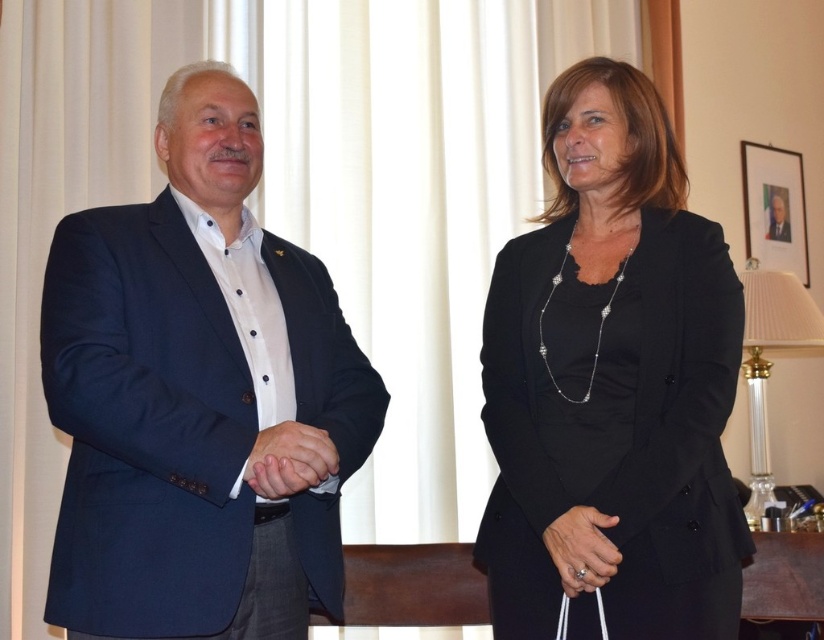
Who is positioned more to the left, matte black suit at left or matte black hand at center?

matte black suit at left

Who is positioned more to the right, matte black suit at left or matte black hand at center?

matte black hand at center

Find the location of a particular element. This screenshot has width=824, height=640. matte black suit at left is located at coordinates (195, 396).

Can you confirm if black satin blazer at center is wider than matte black hands at center?

Indeed, black satin blazer at center has a greater width compared to matte black hands at center.

Locate an element on the screen. This screenshot has height=640, width=824. black satin blazer at center is located at coordinates (612, 376).

The width and height of the screenshot is (824, 640). In order to click on black satin blazer at center in this screenshot , I will do `click(612, 376)`.

Does matte black hands at center come behind matte black hand at center?

No, it is in front of matte black hand at center.

This screenshot has width=824, height=640. What do you see at coordinates (289, 460) in the screenshot?
I see `matte black hands at center` at bounding box center [289, 460].

Image resolution: width=824 pixels, height=640 pixels. What are the coordinates of `matte black hands at center` in the screenshot? It's located at (289, 460).